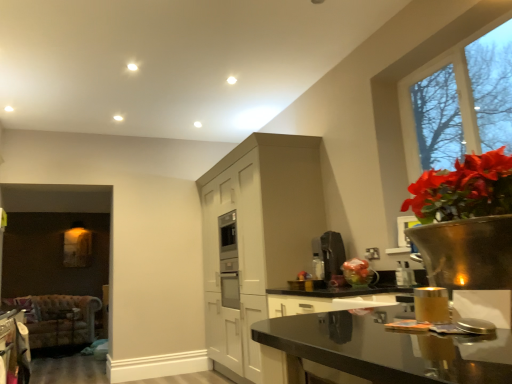
Question: From their relative heights in the image, would you say satin silver coffee maker at upper right, which is the 1th appliance in right-to-left order, is taller or shorter than satin black coffee machine at center, which is the 1th appliance in back-to-front order?

Choices:
 (A) tall
 (B) short

Answer: (B)

Question: Considering the positions of satin silver coffee maker at upper right, marked as the 2th appliance in a left-to-right arrangement, and satin black coffee machine at center, the 1th appliance viewed from the left, in the image, is satin silver coffee maker at upper right, marked as the 2th appliance in a left-to-right arrangement, wider or thinner than satin black coffee machine at center, the 1th appliance viewed from the left,?

Choices:
 (A) thin
 (B) wide

Answer: (A)

Question: Which object is the farthest from the clear glass window at upper right?

Choices:
 (A) velvet-patterned armchair at lower left
 (B) gold metallic candle holder at lower right
 (C) satin silver coffee maker at upper right, marked as the 2th appliance in a left-to-right arrangement
 (D) white matte cabinetry at center
 (E) satin black coffee machine at center, which is the 2th appliance in right-to-left order

Answer: (A)

Question: Estimate the real-world distances between objects in this image. Which object is closer to the velvet-patterned armchair at lower left?

Choices:
 (A) satin black coffee machine at center, which is the 2th appliance in right-to-left order
 (B) clear glass window at upper right
 (C) satin silver coffee maker at upper right, which is the 1th appliance in right-to-left order
 (D) black glossy countertop at lower right
 (E) white matte cabinetry at center

Answer: (E)